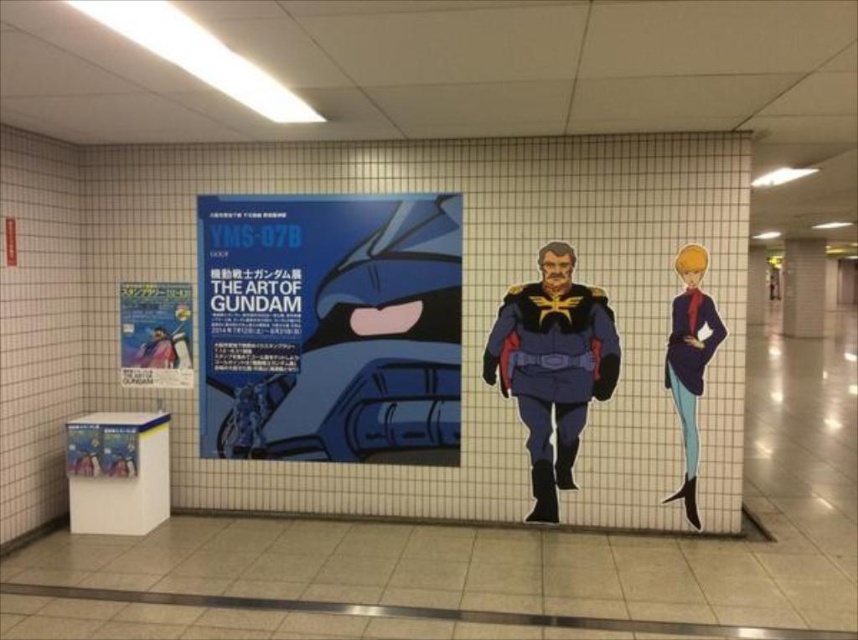
Question: Which object is positioned farthest from the blue fabric uniform at center?

Choices:
 (A) smooth blue suit at right
 (B) blue matte poster at center

Answer: (B)

Question: Which point is closer to the camera taking this photo?

Choices:
 (A) (680, 310)
 (B) (566, 396)
 (C) (168, 289)
 (D) (431, 221)

Answer: (A)

Question: Can you confirm if blue matte poster at center is bigger than smooth blue suit at right?

Choices:
 (A) yes
 (B) no

Answer: (A)

Question: Does smooth blue suit at right have a lesser width compared to matte blue comic book at left?

Choices:
 (A) no
 (B) yes

Answer: (B)

Question: Which of the following is the closest to the observer?

Choices:
 (A) blue matte poster at center
 (B) blue fabric uniform at center
 (C) matte blue comic book at left
 (D) smooth blue suit at right

Answer: (D)

Question: Can you confirm if blue fabric uniform at center is smaller than matte blue comic book at left?

Choices:
 (A) yes
 (B) no

Answer: (B)